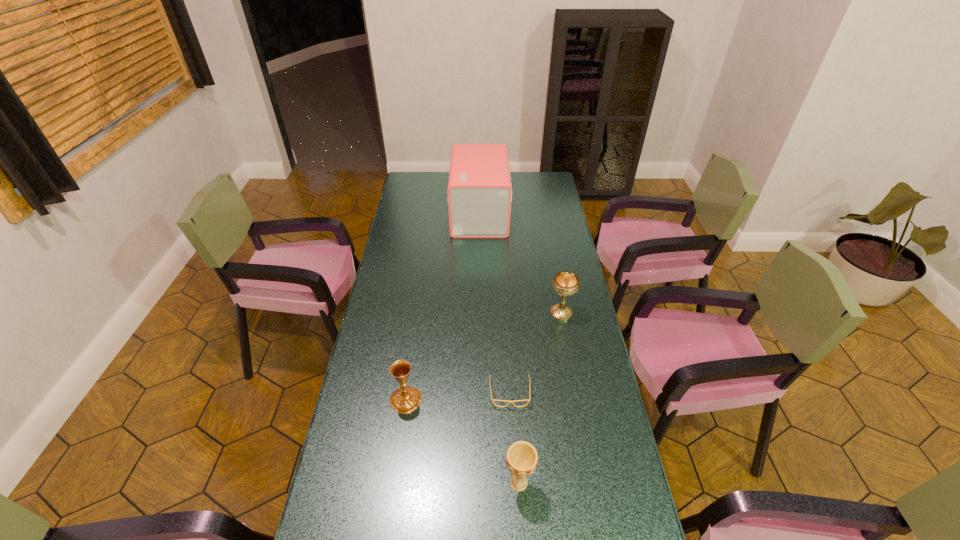
What are the coordinates of `free spot between the nearest chalice and the spectacles` in the screenshot? It's located at (515, 438).

Find the location of a particular element. The image size is (960, 540). vacant space that is in between the box and the shortest object is located at coordinates (494, 303).

Identify the location of unoccupied area between the second farthest object and the leftmost chalice. The width and height of the screenshot is (960, 540). (483, 356).

I want to click on free space between the spectacles and the farthest chalice, so click(536, 353).

Identify the location of vacant region between the box and the nearest chalice. (499, 348).

Where is `empty space that is in between the spectacles and the box`? empty space that is in between the spectacles and the box is located at coordinates (494, 303).

Image resolution: width=960 pixels, height=540 pixels. Find the location of `free space between the shortest object and the nearest object`. free space between the shortest object and the nearest object is located at coordinates (515, 438).

Where is `free space between the rightmost object and the nearest object`? This screenshot has height=540, width=960. free space between the rightmost object and the nearest object is located at coordinates (540, 398).

Locate an element on the screen. free point between the rightmost chalice and the second farthest chalice is located at coordinates (483, 356).

Select which object appears as the second closest to the leftmost chalice. Please provide its 2D coordinates. Your answer should be formatted as a tuple, i.e. [(x, y)], where the tuple contains the x and y coordinates of a point satisfying the conditions above.

[(521, 458)]